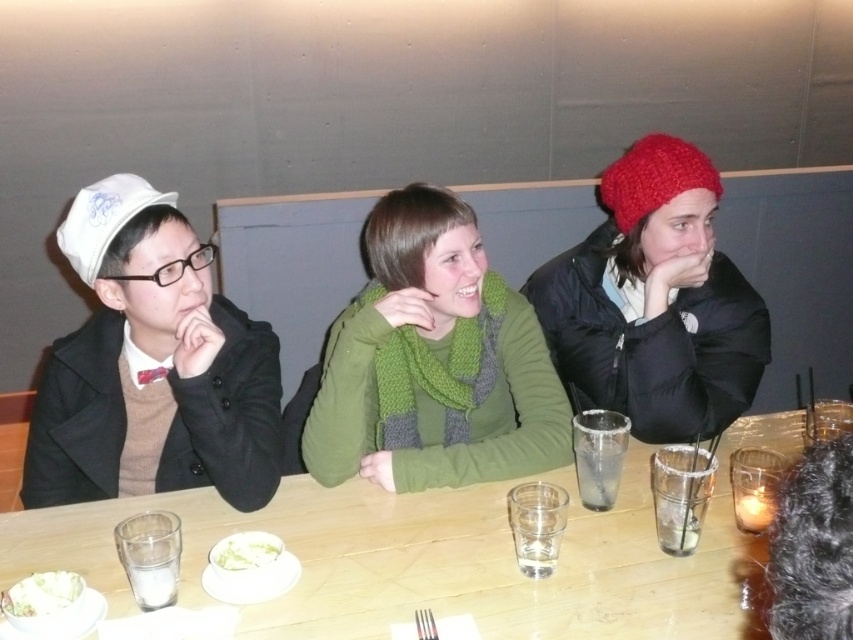
Question: Does wooden table at center appear under green knitted scarf at center?

Choices:
 (A) no
 (B) yes

Answer: (B)

Question: Which of the following is the farthest from the observer?

Choices:
 (A) (253, 486)
 (B) (78, 595)
 (C) (114, 208)
 (D) (424, 472)

Answer: (D)

Question: Estimate the real-world distances between objects in this image. Which object is farther from the white knitted hat at left?

Choices:
 (A) knitted red beanie at upper right
 (B) white creamy soup at center

Answer: (A)

Question: Is knitted red beanie at right closer to camera compared to white creamy soup at center?

Choices:
 (A) yes
 (B) no

Answer: (B)

Question: Does wooden table at center appear on the right side of clear glass at center?

Choices:
 (A) yes
 (B) no

Answer: (B)

Question: Which point is farther to the camera?

Choices:
 (A) (85, 188)
 (B) (120, 493)

Answer: (B)